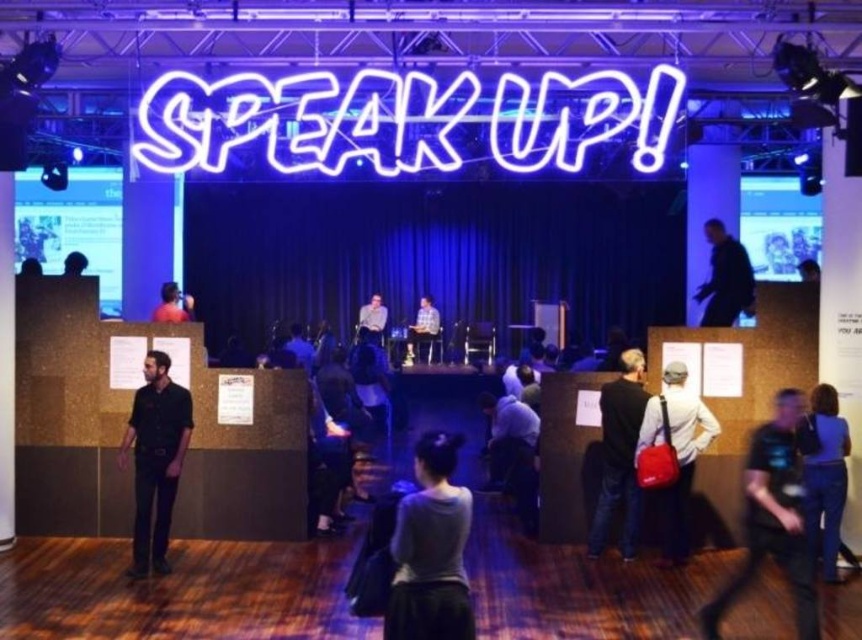
Who is lower down, dark blue shirt at right or light brown leather jacket at center?

Positioned lower is light brown leather jacket at center.

From the picture: Is dark blue shirt at right thinner than light brown leather jacket at center?

In fact, dark blue shirt at right might be wider than light brown leather jacket at center.

Measure the distance between point (728,285) and camera.

A distance of 9.17 meters exists between point (728,285) and camera.

At what (x,y) coordinates should I click in order to perform the action: click on dark blue shirt at right. Please return your answer as a coordinate pair (x, y). Looking at the image, I should click on (725, 278).

The image size is (862, 640). What do you see at coordinates (431, 548) in the screenshot? I see `gray matte sweater at center` at bounding box center [431, 548].

Which is behind, point (391, 589) or point (186, 296)?

Point (186, 296)

Locate an element on the screen. The width and height of the screenshot is (862, 640). gray matte sweater at center is located at coordinates (431, 548).

You are a GUI agent. You are given a task and a screenshot of the screen. Output one action in this format:
    pyautogui.click(x=<x>, y=<y>)
    Task: Click on the gray matte sweater at center
    Image resolution: width=862 pixels, height=640 pixels.
    Given the screenshot: What is the action you would take?
    pyautogui.click(x=431, y=548)

Can you confirm if dark gray shirt at lower right is bigger than matte red bag at center right?

Yes, dark gray shirt at lower right is bigger than matte red bag at center right.

The width and height of the screenshot is (862, 640). I want to click on dark gray shirt at lower right, so click(773, 518).

The image size is (862, 640). In order to click on dark gray shirt at lower right in this screenshot , I will do `click(773, 518)`.